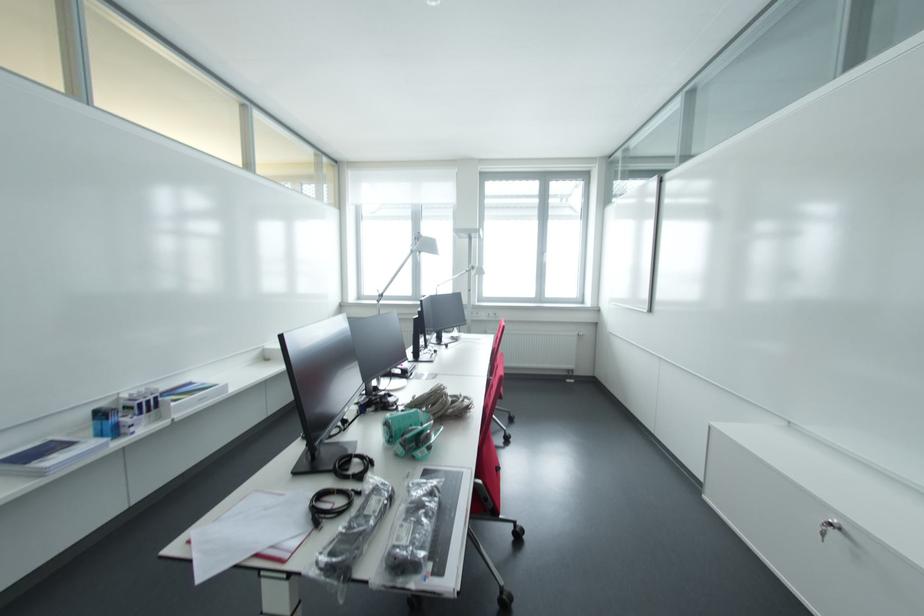
Find the location of a particular element. blue book is located at coordinates (104, 422).